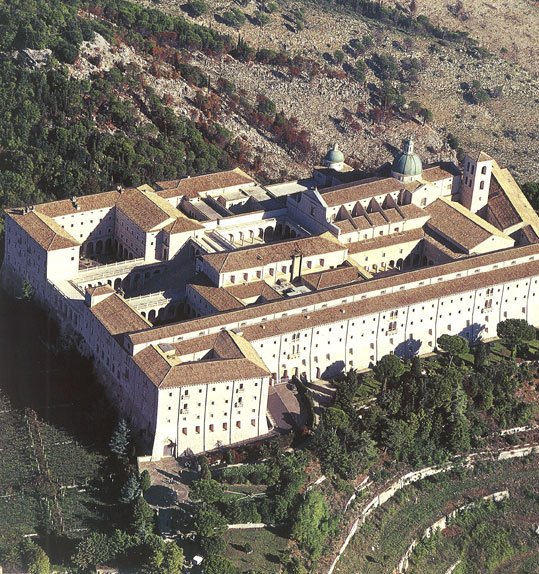
Locate an element on the screen. This screenshot has width=539, height=574. white wall showing different levels of height is located at coordinates pyautogui.click(x=319, y=479), pyautogui.click(x=370, y=480), pyautogui.click(x=381, y=495), pyautogui.click(x=414, y=542), pyautogui.click(x=452, y=570), pyautogui.click(x=245, y=525).